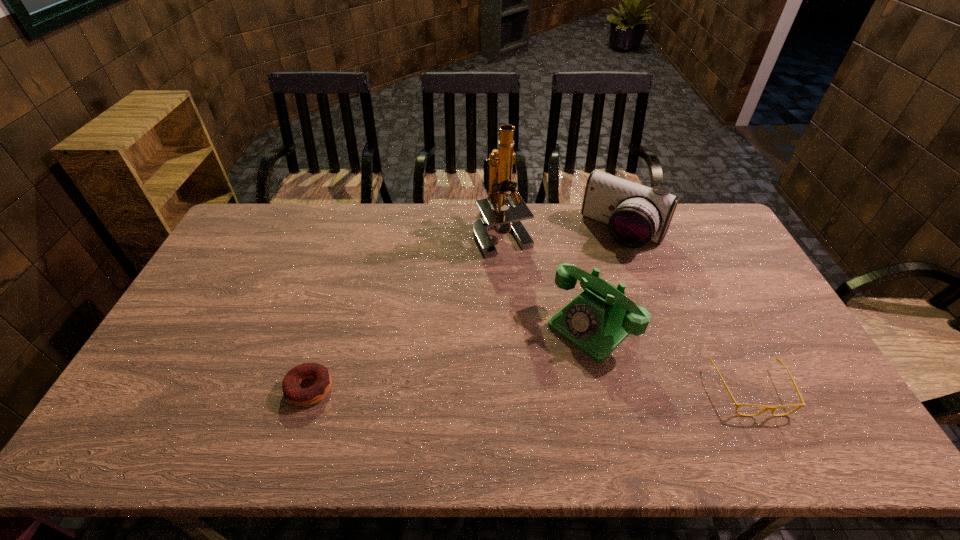
Identify the location of free point between the third farthest object and the camcorder. Image resolution: width=960 pixels, height=540 pixels. (608, 279).

This screenshot has height=540, width=960. I want to click on vacant area between the third nearest object and the leftmost object, so click(450, 357).

Identify the location of free space between the camcorder and the doughnut. (467, 310).

This screenshot has width=960, height=540. I want to click on free area in between the fourth object from right to left and the third farthest object, so click(x=547, y=279).

I want to click on vacant space that is in between the spectacles and the leftmost object, so click(x=530, y=389).

This screenshot has width=960, height=540. What are the coordinates of `unoccupied area between the tallest object and the doughnut` in the screenshot? It's located at (406, 310).

At what (x,y) coordinates should I click in order to perform the action: click on blank region between the spectacles and the camcorder. Please return your answer as a coordinate pair (x, y). The width and height of the screenshot is (960, 540). Looking at the image, I should click on (686, 311).

Find the location of a particular element. The image size is (960, 540). object identified as the third closest to the camcorder is located at coordinates (772, 408).

Select which object is the third closest to the doughnut. Please provide its 2D coordinates. Your answer should be formatted as a tuple, i.e. [(x, y)], where the tuple contains the x and y coordinates of a point satisfying the conditions above.

[(635, 214)]